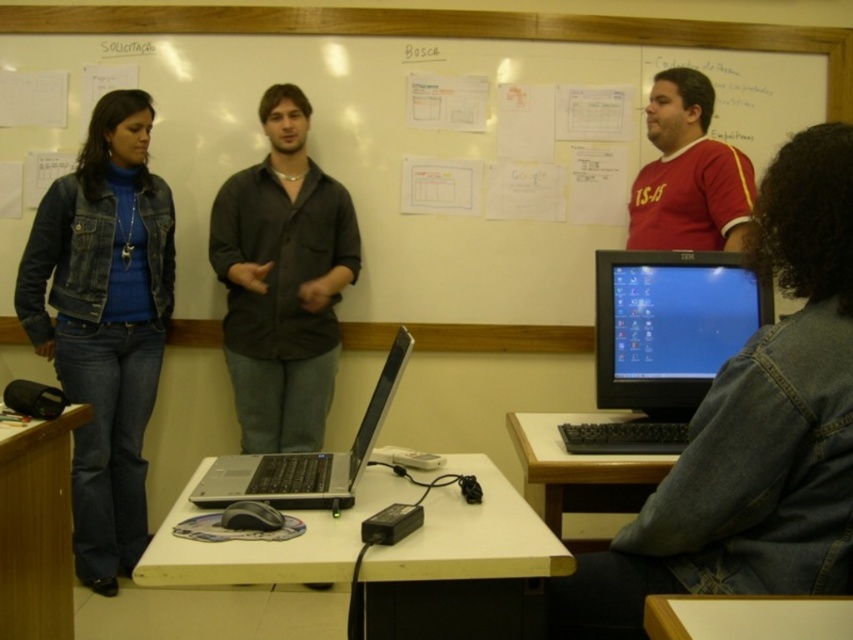
Is wooden desk at lower left behind white wood table at lower right?

Yes, wooden desk at lower left is further from the viewer.

From the picture: Which is more to the left, wooden desk at lower left or white wood table at lower right?

From the viewer's perspective, wooden desk at lower left appears more on the left side.

You are a GUI agent. You are given a task and a screenshot of the screen. Output one action in this format:
    pyautogui.click(x=<x>, y=<y>)
    Task: Click on the wooden desk at lower left
    The image size is (853, 640).
    Given the screenshot: What is the action you would take?
    [36, 529]

Can you confirm if wooden desk at lower left is taller than silver metallic laptop at center?

Correct, wooden desk at lower left is much taller as silver metallic laptop at center.

Who is positioned more to the left, wooden desk at lower left or silver metallic laptop at center?

From the viewer's perspective, wooden desk at lower left appears more on the left side.

This screenshot has width=853, height=640. Identify the location of wooden desk at lower left. (36, 529).

Which is in front, point (734, 417) or point (451, 323)?

Point (734, 417) is more forward.

Where is `denim jacket at lower right`? The image size is (853, 640). denim jacket at lower right is located at coordinates (753, 429).